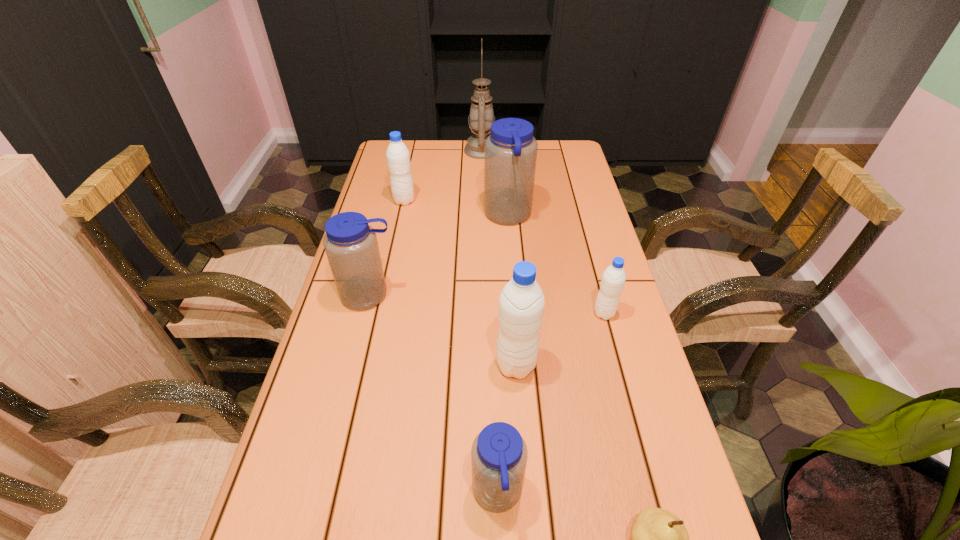
Identify the location of free spot located 0.240m on the front of the rightmost water bottle. The width and height of the screenshot is (960, 540). (630, 410).

Where is `free space located 0.180m with a carrying loop on the side of the smallest blue water bottle`? The width and height of the screenshot is (960, 540). free space located 0.180m with a carrying loop on the side of the smallest blue water bottle is located at coordinates (373, 494).

You are a GUI agent. You are given a task and a screenshot of the screen. Output one action in this format:
    pyautogui.click(x=<x>, y=<y>)
    Task: Click on the vacant space located with a carrying loop on the side of the smallest blue water bottle
    
    Given the screenshot: What is the action you would take?
    pyautogui.click(x=395, y=494)

Locate an element on the screen. This screenshot has width=960, height=540. vacant space located 0.120m with a carrying loop on the side of the smallest blue water bottle is located at coordinates (406, 494).

Identify the location of object located in the far edge section of the desktop. (481, 117).

Locate an element on the screen. object at the right edge is located at coordinates [x=613, y=279].

Find the location of a particular element. This screenshot has width=960, height=540. vacant region at the far edge of the desktop is located at coordinates (434, 142).

This screenshot has width=960, height=540. Find the location of `vacant region at the left edge of the desktop`. vacant region at the left edge of the desktop is located at coordinates click(x=367, y=352).

Locate an element on the screen. vacant space at the right edge is located at coordinates (556, 230).

You are a GUI agent. You are given a task and a screenshot of the screen. Output one action in this format:
    pyautogui.click(x=<x>, y=<y>)
    Task: Click on the vacant space at the far right corner
    Image resolution: width=960 pixels, height=540 pixels.
    Given the screenshot: What is the action you would take?
    pyautogui.click(x=560, y=147)